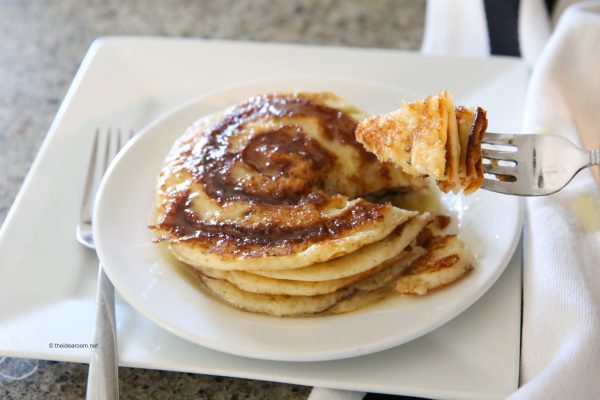
Where is `napkin`? Image resolution: width=600 pixels, height=400 pixels. napkin is located at coordinates (572, 322).